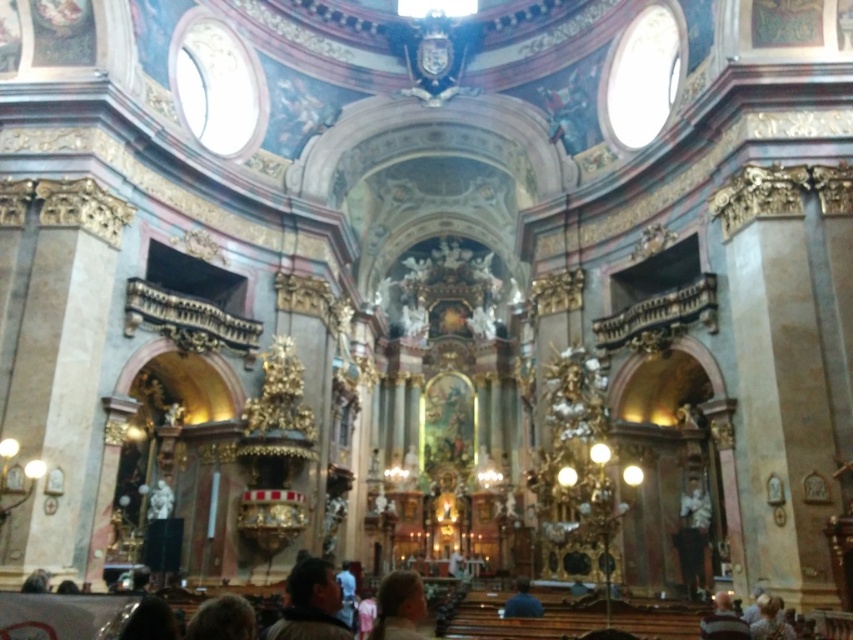
You are a visitor in this church and you want to take a photo of the dark brown leather jacket at center and the blonde hair at lower right. Which object should you focus on first if you want to capture both in the same frame without moving the camera?

You should focus on the dark brown leather jacket at center first because it is larger and closer to the camera than the blonde hair at lower right, ensuring both will be in focus when using depth of field appropriately.

You are standing in the grand cathedral and notice a dark brown leather jacket at center. Where exactly is the dark brown leather jacket located in the cathedral?

The dark brown leather jacket at center is located at point (310, 604) in the cathedral.

You are a photographer standing in the center of the grand cathedral. You want to take a photo of the dark brown leather jacket at center but your camera is on a tripod 100 feet away from you. Can you reach your camera in time before the jacket is moved?

The dark brown leather jacket at center and camera are 100.68 feet apart, so the distance between them is over 100 feet. You might not be able to reach the camera quickly enough before the jacket is moved.